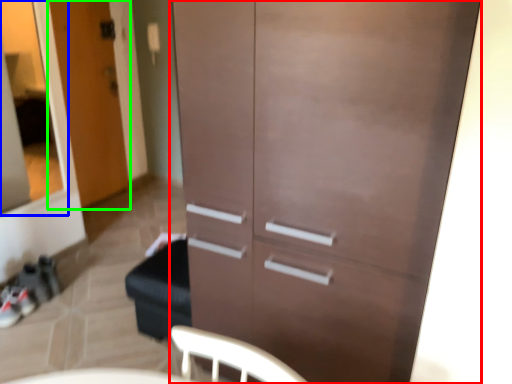
Question: Which object is positioned farthest from cupboard (highlighted by a red box)? Select from glass door (highlighted by a blue box) and door (highlighted by a green box).

Choices:
 (A) glass door
 (B) door

Answer: (A)